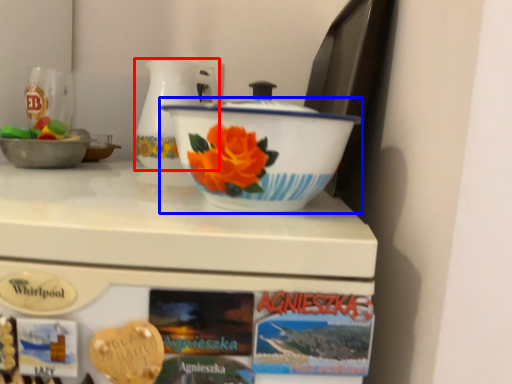
Question: Which object is further to the camera taking this photo, jug (highlighted by a red box) or basin (highlighted by a blue box)?

Choices:
 (A) jug
 (B) basin

Answer: (A)